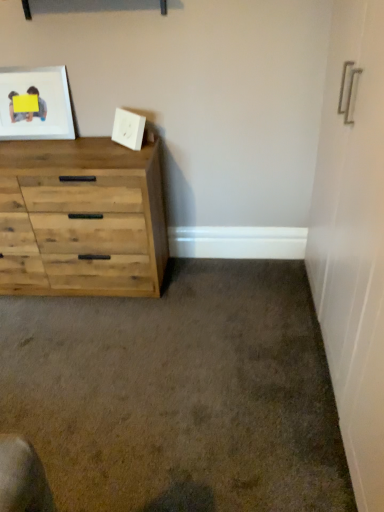
In order to click on vacant area situated to the left side of white matte picture frame at upper center, which is counted as the 1th picture frame, starting from the right in this screenshot , I will do `click(102, 144)`.